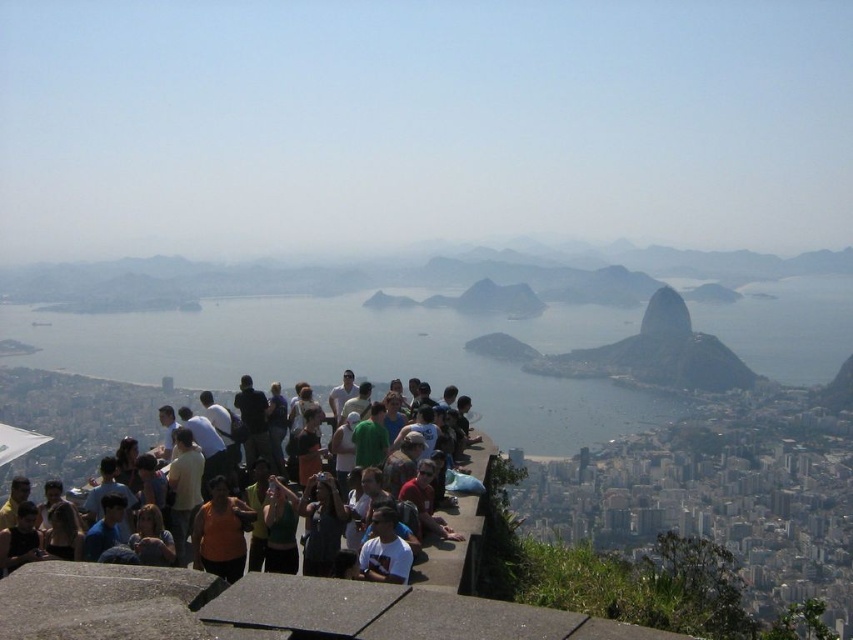
What do you see at coordinates (321, 524) in the screenshot? I see `matte black camera at center` at bounding box center [321, 524].

Which is above, matte black camera at center or green matte rock at center?

green matte rock at center

This screenshot has width=853, height=640. In order to click on matte black camera at center in this screenshot , I will do `click(321, 524)`.

You are a GUI agent. You are given a task and a screenshot of the screen. Output one action in this format:
    pyautogui.click(x=<x>, y=<y>)
    Task: Click on the matte black camera at center
    The image size is (853, 640).
    Given the screenshot: What is the action you would take?
    pyautogui.click(x=321, y=524)

Can you confirm if multicolored casual clothing at center is taller than matte black camera at center?

Indeed, multicolored casual clothing at center has a greater height compared to matte black camera at center.

Can you confirm if multicolored casual clothing at center is thinner than matte black camera at center?

No.

Which is behind, point (440, 545) or point (308, 561)?

The point (440, 545) is behind.

Find the location of a particular element. multicolored casual clothing at center is located at coordinates (76, 420).

In the scene shown: Can you confirm if clear water at center is positioned to the right of denim jacket at lower left?

Correct, you'll find clear water at center to the right of denim jacket at lower left.

Is point (570, 401) positioned behind point (149, 504)?

Yes, point (570, 401) is behind point (149, 504).

At what (x,y) coordinates should I click in order to perform the action: click on clear water at center. Please return your answer as a coordinate pair (x, y). Looking at the image, I should click on (357, 356).